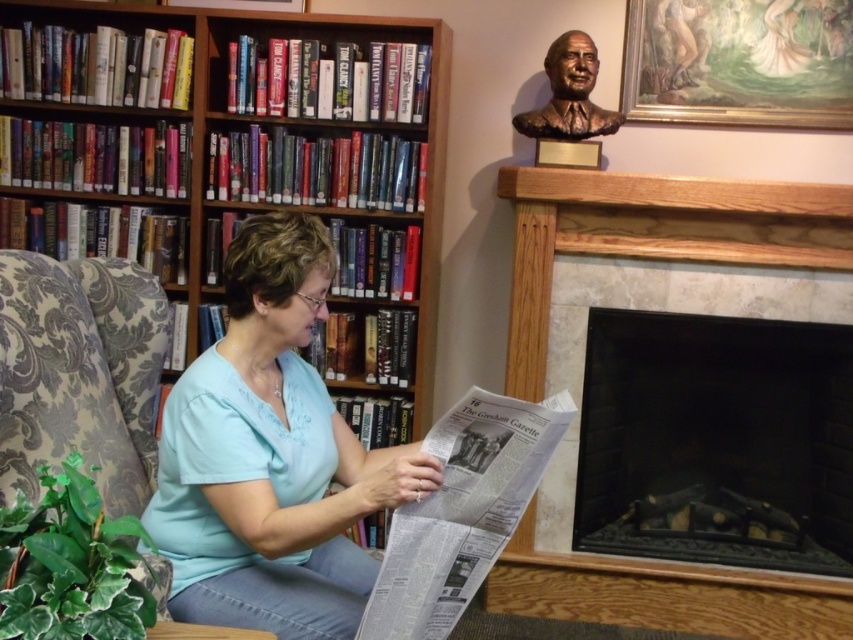
Who is more forward, (x=25, y=292) or (x=589, y=109)?

Point (x=25, y=292) is in front.

Does patterned fabric armchair at left come in front of bronze bust at upper right?

Yes.

At what (x,y) coordinates should I click in order to perform the action: click on patterned fabric armchair at left. Please return your answer as a coordinate pair (x, y). This screenshot has height=640, width=853. Looking at the image, I should click on (79, 372).

Does marble fireplace at center appear on the left side of bronze bust at upper right?

Incorrect, marble fireplace at center is not on the left side of bronze bust at upper right.

Who is positioned more to the left, marble fireplace at center or bronze bust at upper right?

bronze bust at upper right

Is point (773, 636) positioned behind point (585, 36)?

That is False.

This screenshot has height=640, width=853. Identify the location of marble fireplace at center. (x=654, y=236).

Between wooden bookshelf at upper left and black metal fireplace at lower right, which one has more height?

Standing taller between the two is wooden bookshelf at upper left.

Does wooden bookshelf at upper left appear on the left side of black metal fireplace at lower right?

Correct, you'll find wooden bookshelf at upper left to the left of black metal fireplace at lower right.

Which is behind, point (18, 349) or point (630, 492)?

Point (630, 492)

Where is `wooden bookshelf at upper left`? This screenshot has width=853, height=640. wooden bookshelf at upper left is located at coordinates (175, 230).